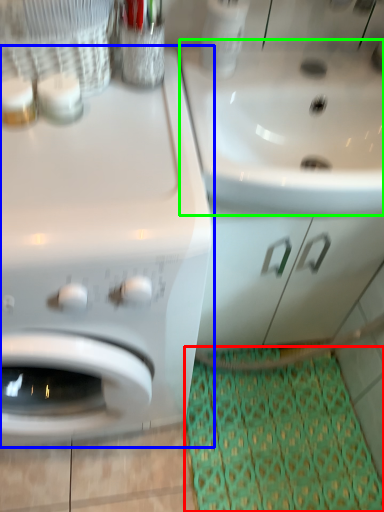
Question: Considering the real-world distances, which object is farthest from doormat (highlighted by a red box)? washing machine (highlighted by a blue box) or sink (highlighted by a green box)?

Choices:
 (A) washing machine
 (B) sink

Answer: (B)